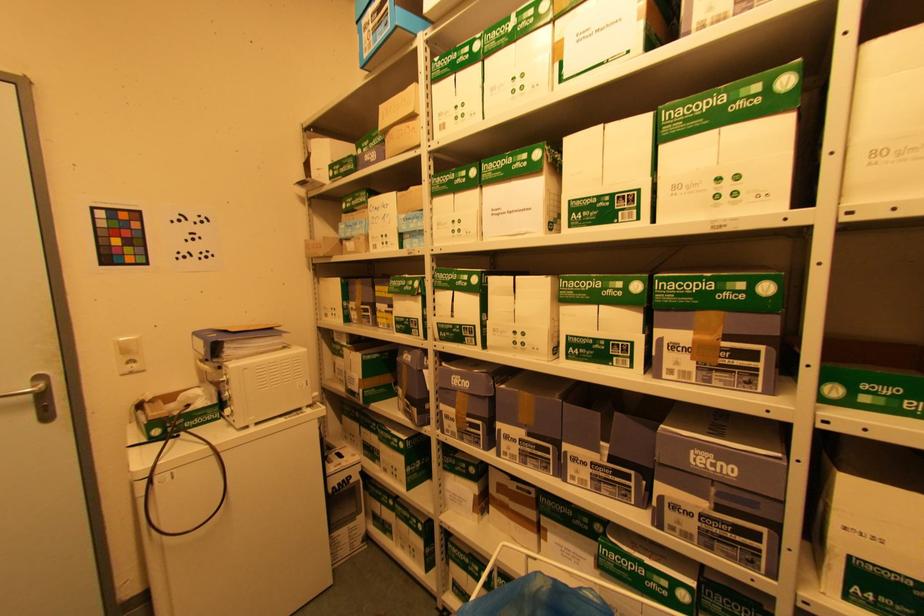
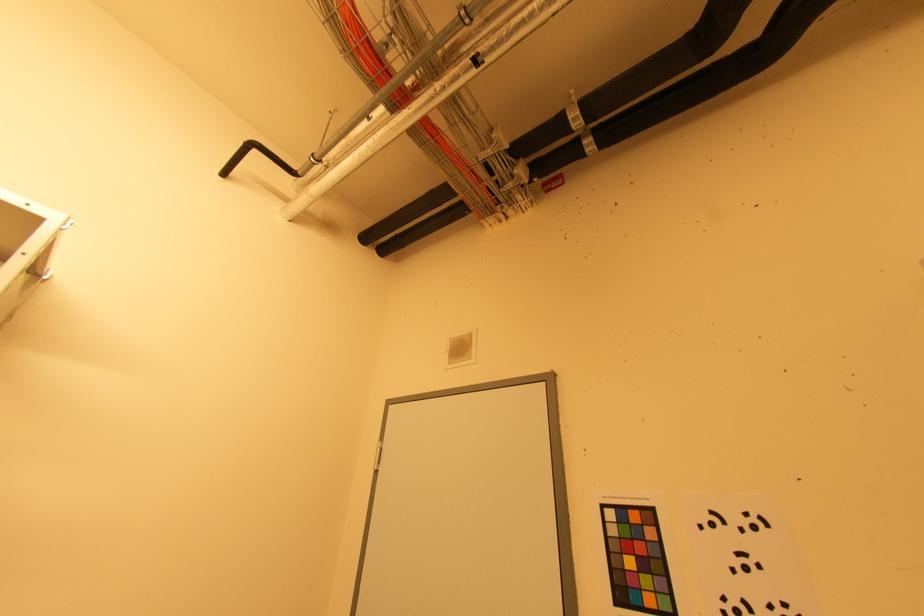
The first image is from the beginning of the video and the second image is from the end. How did the camera likely rotate when shooting the video?

The rotation direction of the camera is left-up.